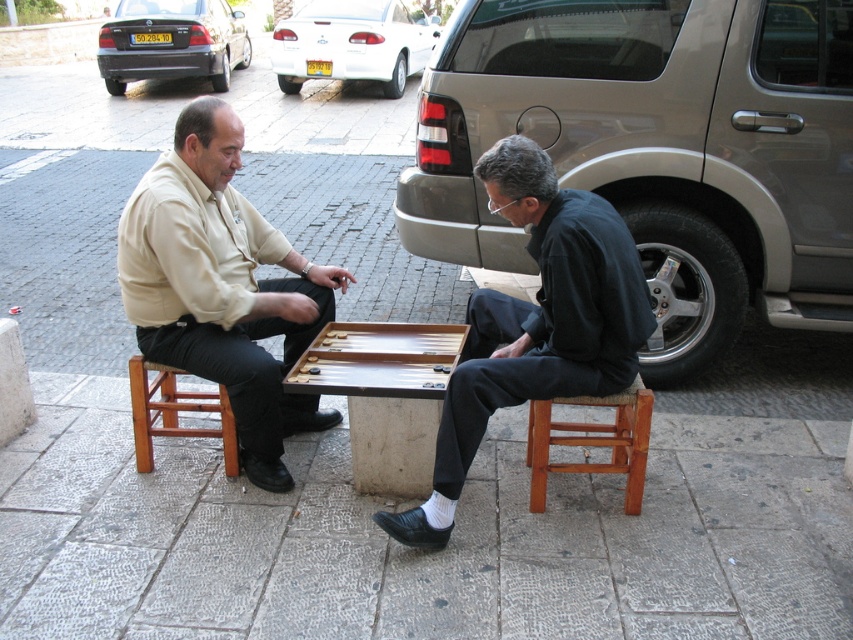
Question: Is beige cotton shirt at left below dark blue fabric shirt at center?

Choices:
 (A) yes
 (B) no

Answer: (B)

Question: Which point is farther to the camera?

Choices:
 (A) (167, 275)
 (B) (544, 264)
 (C) (219, 401)
 (D) (445, 384)

Answer: (C)

Question: Considering the real-world distances, which object is farthest from the wooden backgammon board at center?

Choices:
 (A) wooden stool at lower right
 (B) beige cotton shirt at left
 (C) wooden stool at left

Answer: (C)

Question: Which of the following is the closest to the observer?

Choices:
 (A) wooden stool at lower right
 (B) wooden backgammon board at center

Answer: (B)

Question: Can you confirm if wooden backgammon board at center is smaller than wooden stool at left?

Choices:
 (A) no
 (B) yes

Answer: (B)

Question: Is dark blue fabric shirt at center further to camera compared to wooden backgammon board at center?

Choices:
 (A) no
 (B) yes

Answer: (A)